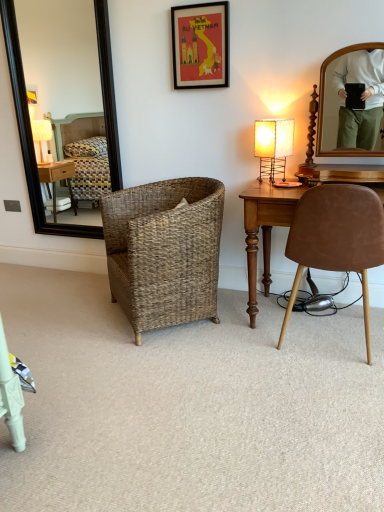
At what (x,y) coordinates should I click in order to perform the action: click on free location in front of woven brown basket at center, which is the 1th chair from left to right. Please return your answer as a coordinate pair (x, y). Looking at the image, I should click on (176, 366).